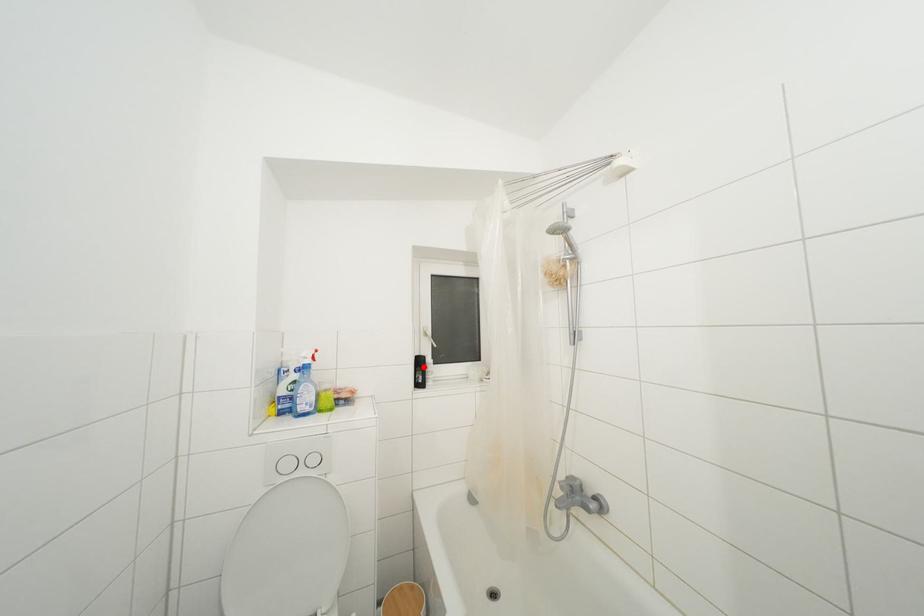
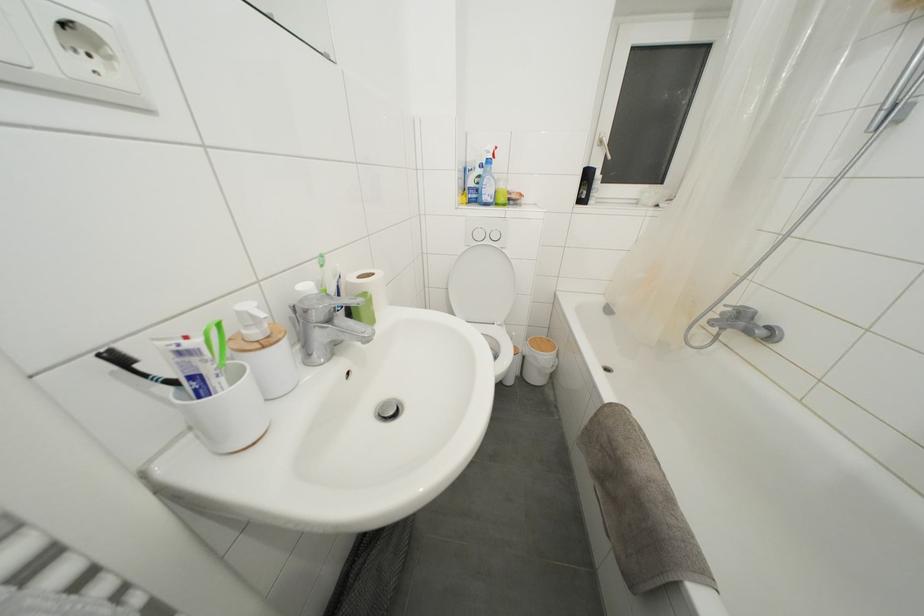
Question: I am providing you with two images of the same scene from different viewpoints. In image1, a red point is highlighted. Considering the same 3D point in image2, which of the following is correct?

Choices:
 (A) It is closer
 (B) It is farther

Answer: (A)